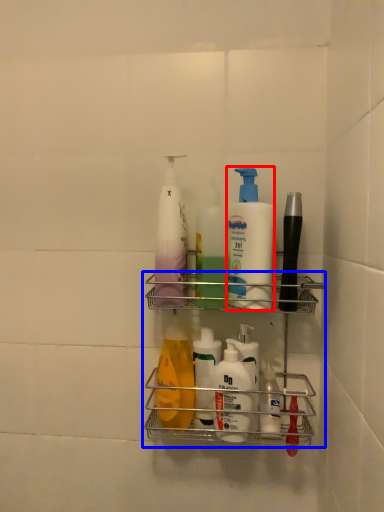
Question: Which object is closer to the camera taking this photo, cleaning product (highlighted by a red box) or shelf (highlighted by a blue box)?

Choices:
 (A) cleaning product
 (B) shelf

Answer: (B)